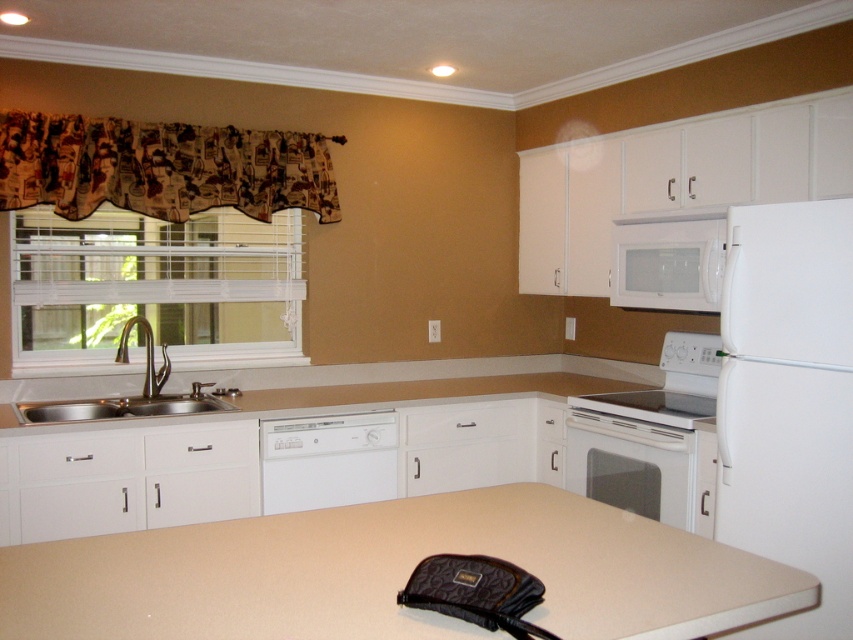
Is white matte refrigerator at right closer to the viewer compared to white glossy electric stove at center?

Yes, it is in front of white glossy electric stove at center.

Looking at this image, is white matte refrigerator at right above white glossy electric stove at center?

Yes, white matte refrigerator at right is above white glossy electric stove at center.

Is point (733, 211) farther from camera compared to point (606, 396)?

No, it is not.

Identify the location of white matte refrigerator at right. The image size is (853, 640). (788, 401).

Does printed fabric valance at upper left have a lesser width compared to stainless steel sink at left?

In fact, printed fabric valance at upper left might be wider than stainless steel sink at left.

Is point (171, 138) more distant than point (164, 360)?

That is False.

I want to click on printed fabric valance at upper left, so click(x=160, y=168).

You are a GUI agent. You are given a task and a screenshot of the screen. Output one action in this format:
    pyautogui.click(x=<x>, y=<y>)
    Task: Click on the white glossy oven at lower center
    This screenshot has height=640, width=853.
    Given the screenshot: What is the action you would take?
    pyautogui.click(x=631, y=465)

Between point (647, 460) and point (21, 413), which one is positioned in front?

Point (21, 413) is in front.

Locate an element on the screen. The width and height of the screenshot is (853, 640). white glossy oven at lower center is located at coordinates (631, 465).